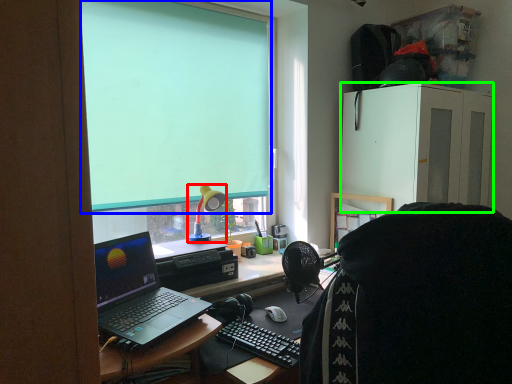
Question: Which is farther away from lamp (highlighted by a red box)? projection screen (highlighted by a blue box) or cabinetry (highlighted by a green box)?

Choices:
 (A) projection screen
 (B) cabinetry

Answer: (B)